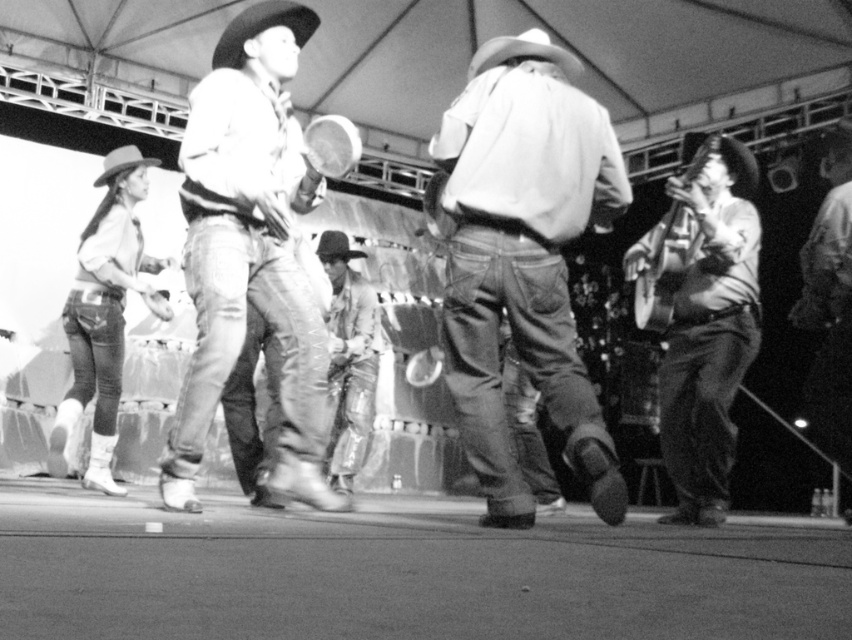
You are a photographer at the country music event. You want to take a photo of the ripped denim jeans at center and the leather cowboy boots at center. Which one should you focus on to ensure the subject is in clear view?

The ripped denim jeans at center is closer to the viewer than the leather cowboy boots at center, so focusing on the ripped denim jeans at center will ensure it is in clear view.